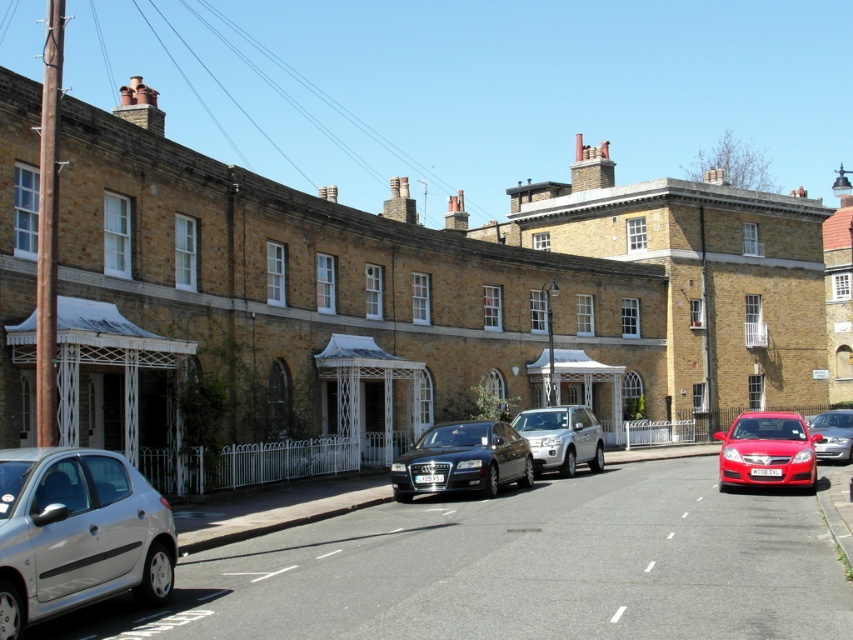
Question: Where is silver metallic hatchback at lower left located in relation to silver metallic suv at center in the image?

Choices:
 (A) below
 (B) above

Answer: (B)

Question: Where is shiny red sedan at lower right located in relation to silver metallic suv at center in the image?

Choices:
 (A) right
 (B) left

Answer: (A)

Question: Which point is closer to the camera?

Choices:
 (A) silver metallic suv at center
 (B) silver metallic hatchback at lower left
 (C) shiny red sedan at lower right

Answer: (B)

Question: Among these points, which one is nearest to the camera?

Choices:
 (A) pos(828,458)
 (B) pos(521,435)

Answer: (B)

Question: Can you confirm if shiny red sedan at lower right is positioned to the right of silver metallic suv at center?

Choices:
 (A) yes
 (B) no

Answer: (A)

Question: Which of the following is the farthest from the observer?

Choices:
 (A) (419, 480)
 (B) (546, 433)
 (C) (57, 609)

Answer: (B)